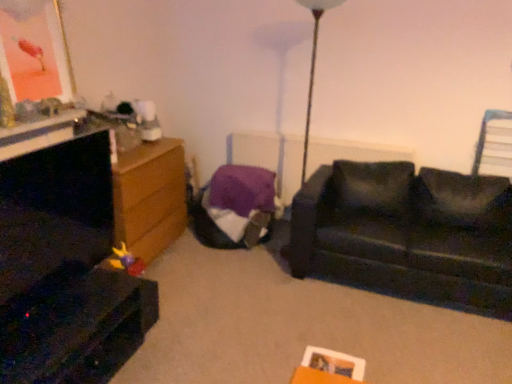
Question: From the image's perspective, does purple fabric radiator at center appear lower than metallic gold picture frame at upper left?

Choices:
 (A) no
 (B) yes

Answer: (B)

Question: From the image's perspective, is purple fabric radiator at center on metallic gold picture frame at upper left?

Choices:
 (A) yes
 (B) no

Answer: (B)

Question: Is purple fabric radiator at center oriented away from metallic gold picture frame at upper left?

Choices:
 (A) no
 (B) yes

Answer: (A)

Question: Is purple fabric radiator at center placed right next to metallic gold picture frame at upper left?

Choices:
 (A) no
 (B) yes

Answer: (A)

Question: Does purple fabric radiator at center come in front of metallic gold picture frame at upper left?

Choices:
 (A) yes
 (B) no

Answer: (B)

Question: Does point (488, 221) appear closer or farther from the camera than point (211, 218)?

Choices:
 (A) closer
 (B) farther

Answer: (A)

Question: From the image's perspective, is black leather couch at right located above or below purple fabric bean bag at center?

Choices:
 (A) above
 (B) below

Answer: (B)

Question: Considering the positions of black leather couch at right and purple fabric bean bag at center in the image, is black leather couch at right wider or thinner than purple fabric bean bag at center?

Choices:
 (A) wide
 (B) thin

Answer: (A)

Question: Is black leather couch at right situated inside purple fabric bean bag at center or outside?

Choices:
 (A) inside
 (B) outside

Answer: (B)

Question: In terms of width, does metallic gold picture frame at upper left look wider or thinner when compared to black leather couch at right?

Choices:
 (A) thin
 (B) wide

Answer: (A)

Question: Considering the positions of metallic gold picture frame at upper left and black leather couch at right in the image, is metallic gold picture frame at upper left bigger or smaller than black leather couch at right?

Choices:
 (A) big
 (B) small

Answer: (B)

Question: Is point pos(35,14) positioned closer to the camera than point pos(331,195)?

Choices:
 (A) farther
 (B) closer

Answer: (B)

Question: From the image's perspective, is metallic gold picture frame at upper left above or below black leather couch at right?

Choices:
 (A) above
 (B) below

Answer: (A)

Question: In terms of size, does purple fabric radiator at center appear bigger or smaller than dark wood entertainment center at left?

Choices:
 (A) big
 (B) small

Answer: (A)

Question: From their relative heights in the image, would you say purple fabric radiator at center is taller or shorter than dark wood entertainment center at left?

Choices:
 (A) short
 (B) tall

Answer: (A)